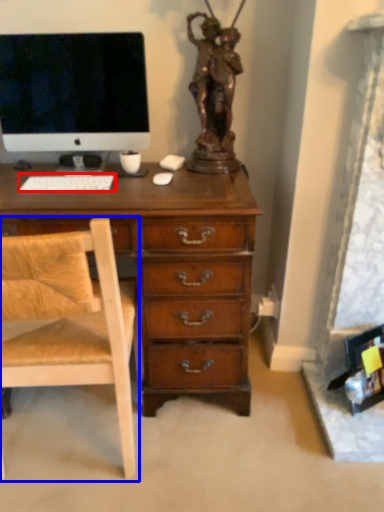
Question: Which object is further to the camera taking this photo, computer keyboard (highlighted by a red box) or chair (highlighted by a blue box)?

Choices:
 (A) computer keyboard
 (B) chair

Answer: (A)